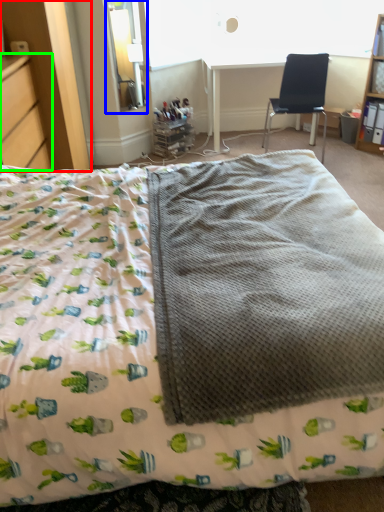
Question: Considering the real-world distances, which object is closest to dresser (highlighted by a red box)? window screen (highlighted by a blue box) or file cabinet (highlighted by a green box).

Choices:
 (A) window screen
 (B) file cabinet

Answer: (B)